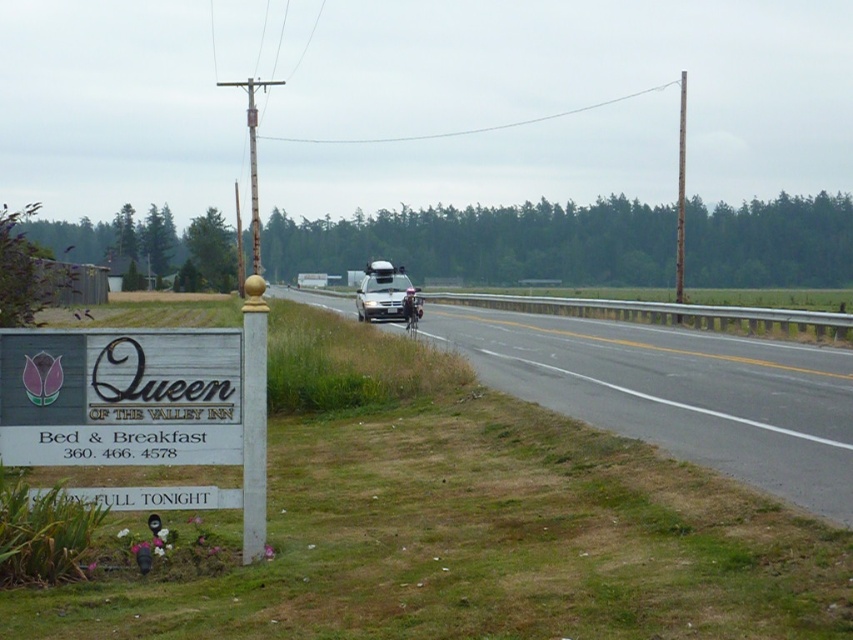
You are driving a car and see the asphalt road at center and the white matte van at center. Which object takes up more space in the scene?

The white matte van at center takes up more space in the scene because the asphalt road at center has a smaller size compared to it.

You are driving on a road and see the asphalt road at center and the wooden signboard at lower left. Which one is located to the right side from your perspective?

The asphalt road at center is located to the right of the wooden signboard at lower left, so the asphalt road at center is on the right side.